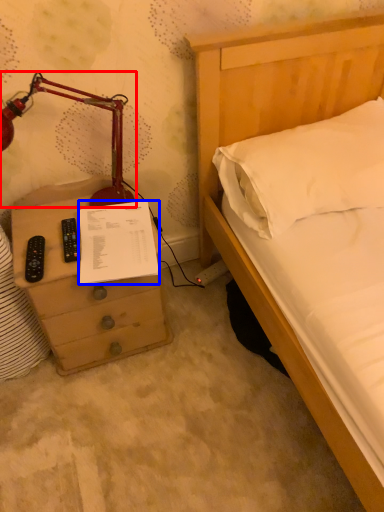
Question: Which object appears farthest to the camera in this image, lamp (highlighted by a red box) or document (highlighted by a blue box)?

Choices:
 (A) lamp
 (B) document

Answer: (B)